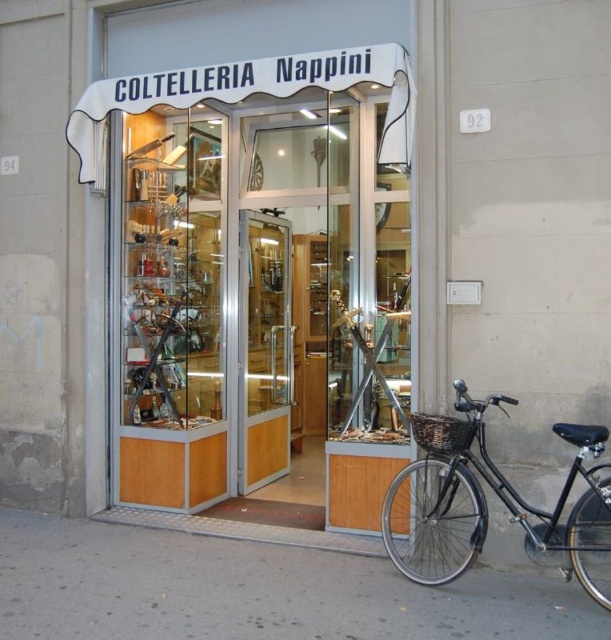
Who is positioned more to the left, wooden display case at center or gray concrete pavement at lower center?

gray concrete pavement at lower center

Is wooden display case at center thinner than gray concrete pavement at lower center?

Yes.

At what (x,y) coordinates should I click in order to perform the action: click on wooden display case at center. Please return your answer as a coordinate pair (x, y). The image size is (611, 640). Looking at the image, I should click on (258, 273).

Between wooden display case at center and black matte bicycle at lower right, which one appears on the left side from the viewer's perspective?

Positioned to the left is wooden display case at center.

Can you confirm if wooden display case at center is positioned below black matte bicycle at lower right?

Actually, wooden display case at center is above black matte bicycle at lower right.

Does point (346, 65) lie behind point (415, 547)?

Yes.

Locate an element on the screen. The image size is (611, 640). wooden display case at center is located at coordinates (258, 273).

Between gray concrete pavement at lower center and black matte bicycle at lower right, which one is positioned lower?

Positioned lower is gray concrete pavement at lower center.

Is gray concrete pavement at lower center below black matte bicycle at lower right?

Indeed, gray concrete pavement at lower center is positioned under black matte bicycle at lower right.

The width and height of the screenshot is (611, 640). Describe the element at coordinates (254, 592) in the screenshot. I see `gray concrete pavement at lower center` at that location.

I want to click on gray concrete pavement at lower center, so click(x=254, y=592).